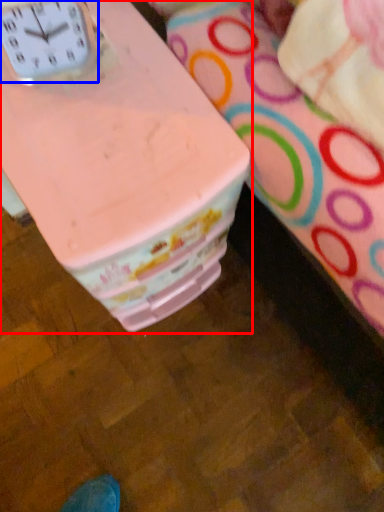
Question: Which point is further to the camera, table (highlighted by a red box) or clock (highlighted by a blue box)?

Choices:
 (A) table
 (B) clock

Answer: (A)